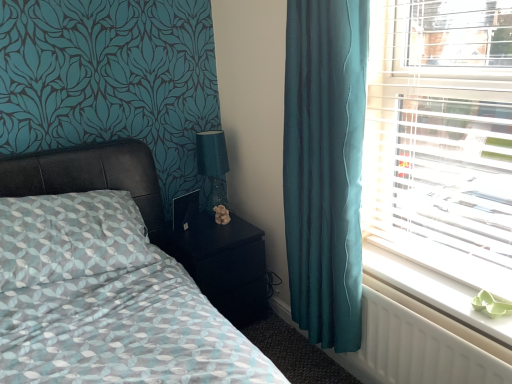
Where is `vacant point above white plastic radiator at lower right (from a real-world perspective)`? vacant point above white plastic radiator at lower right (from a real-world perspective) is located at coordinates (x=433, y=287).